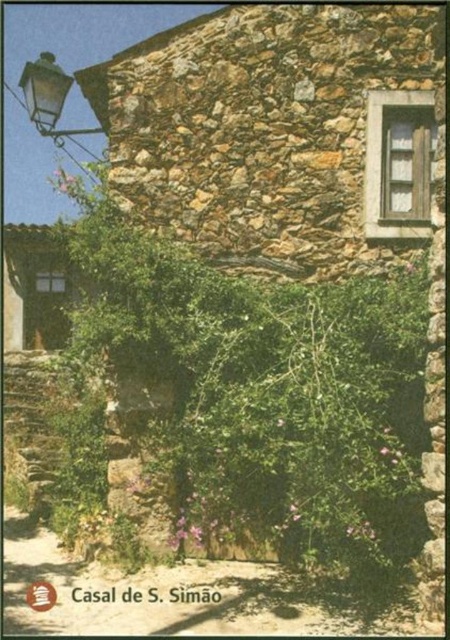
Between point (341, 332) and point (37, 60), which one is positioned in front?

Point (341, 332) is more forward.

Which is more to the left, green leafy ivy at center or matte black lantern at upper left?

Positioned to the left is matte black lantern at upper left.

Where is `green leafy ivy at center`? green leafy ivy at center is located at coordinates (256, 387).

Find the location of a particular element. green leafy ivy at center is located at coordinates (256, 387).

This screenshot has height=640, width=450. What are the coordinates of `green leafy ivy at center` in the screenshot? It's located at 256,387.

Which is more to the left, wooden window at upper right or matte black lantern at upper left?

From the viewer's perspective, matte black lantern at upper left appears more on the left side.

Is wooden window at upper right smaller than matte black lantern at upper left?

Indeed, wooden window at upper right has a smaller size compared to matte black lantern at upper left.

Which is behind, point (391, 99) or point (63, 102)?

The point (63, 102) is behind.

The image size is (450, 640). Find the location of `wooden window at upper right`. wooden window at upper right is located at coordinates point(399,163).